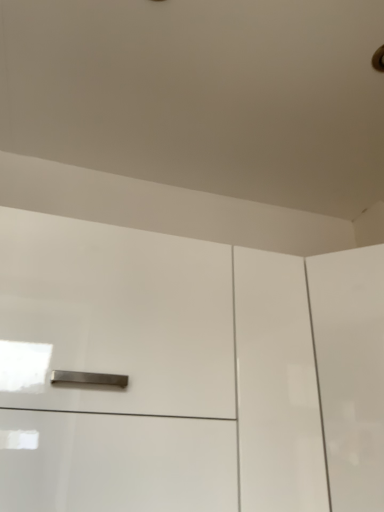
Question: Does glossy white cabinet at center come in front of white glossy cabinet at right?

Choices:
 (A) yes
 (B) no

Answer: (A)

Question: Does glossy white cabinet at center have a smaller size compared to white glossy cabinet at right?

Choices:
 (A) no
 (B) yes

Answer: (A)

Question: Is glossy white cabinet at center not near white glossy cabinet at right?

Choices:
 (A) yes
 (B) no

Answer: (B)

Question: Does glossy white cabinet at center have a greater height compared to white glossy cabinet at right?

Choices:
 (A) no
 (B) yes

Answer: (B)

Question: Does glossy white cabinet at center touch white glossy cabinet at right?

Choices:
 (A) yes
 (B) no

Answer: (B)

Question: Does glossy white cabinet at center have a larger size compared to white glossy cabinet at right?

Choices:
 (A) yes
 (B) no

Answer: (A)

Question: From a real-world perspective, is white glossy cabinet at right positioned under glossy white cabinet at center based on gravity?

Choices:
 (A) no
 (B) yes

Answer: (B)

Question: Considering the relative sizes of white glossy cabinet at right and glossy white cabinet at center in the image provided, is white glossy cabinet at right shorter than glossy white cabinet at center?

Choices:
 (A) yes
 (B) no

Answer: (A)

Question: Is the position of white glossy cabinet at right less distant than that of glossy white cabinet at center?

Choices:
 (A) yes
 (B) no

Answer: (B)

Question: Can you see white glossy cabinet at right touching glossy white cabinet at center?

Choices:
 (A) yes
 (B) no

Answer: (B)

Question: Is white glossy cabinet at right not within glossy white cabinet at center?

Choices:
 (A) yes
 (B) no

Answer: (A)

Question: Does white glossy cabinet at right have a larger size compared to glossy white cabinet at center?

Choices:
 (A) yes
 (B) no

Answer: (B)

Question: Is glossy white cabinet at center bigger or smaller than white glossy cabinet at right?

Choices:
 (A) big
 (B) small

Answer: (A)